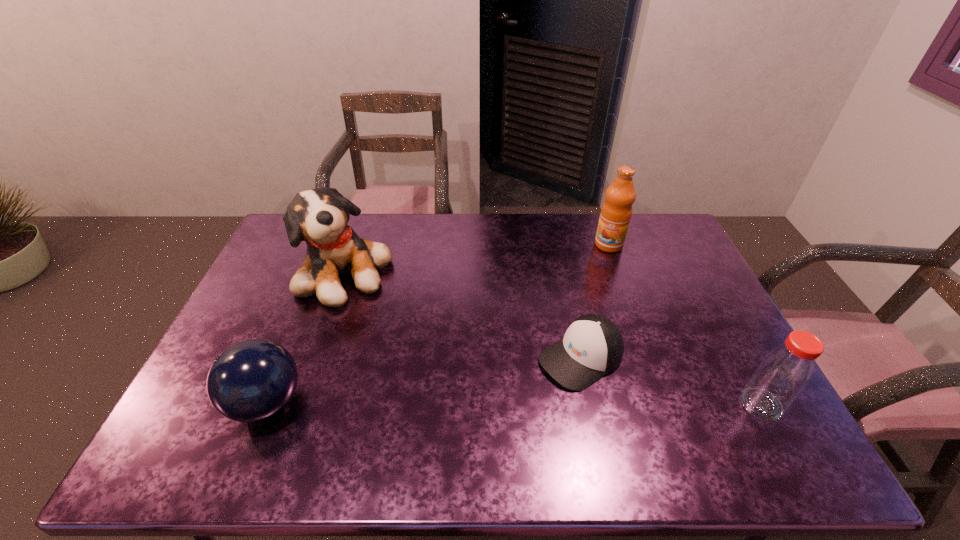
Identify the location of free space that is in between the second object from right to left and the puppy. The height and width of the screenshot is (540, 960). (477, 259).

The image size is (960, 540). Identify the location of free space between the fourth object from left to right and the second shortest object. (438, 323).

Identify the location of free space that is in between the fourth tallest object and the third shortest object. (514, 403).

Locate an element on the screen. unoccupied position between the third shortest object and the second shortest object is located at coordinates (514, 403).

The height and width of the screenshot is (540, 960). I want to click on vacant space that's between the puppy and the third object from right to left, so click(464, 316).

Locate an element on the screen. The height and width of the screenshot is (540, 960). object identified as the third closest to the bowling ball is located at coordinates (616, 212).

At what (x,y) coordinates should I click in order to perform the action: click on the third closest object to the fruit juice. Please return your answer as a coordinate pair (x, y). The image size is (960, 540). Looking at the image, I should click on (319, 217).

The height and width of the screenshot is (540, 960). Find the location of `free space that satisfies the following two spatial constraints: 1. on the back side of the cap; 2. on the right side of the fruit juice`. free space that satisfies the following two spatial constraints: 1. on the back side of the cap; 2. on the right side of the fruit juice is located at coordinates (557, 245).